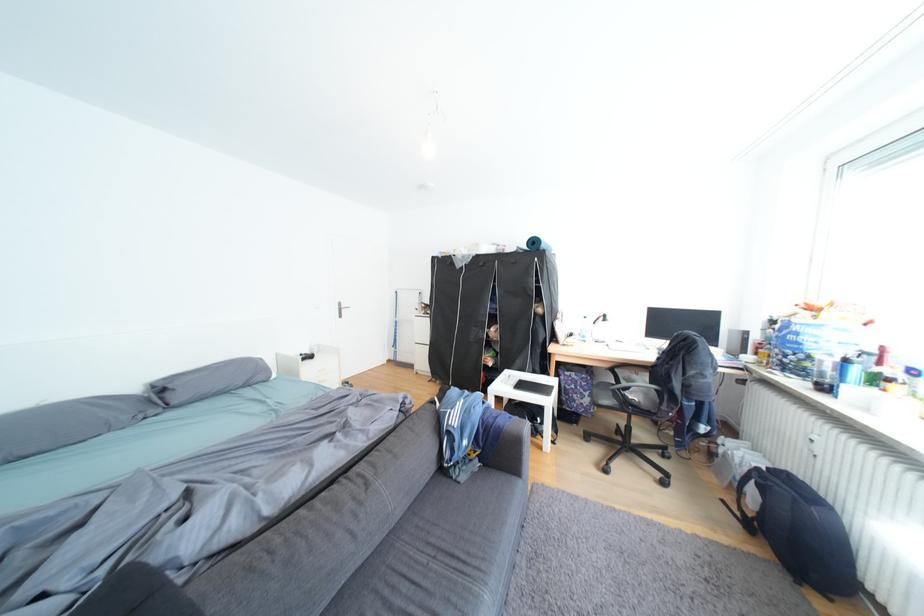
This screenshot has height=616, width=924. What do you see at coordinates (639, 394) in the screenshot? I see `the black chair armrest` at bounding box center [639, 394].